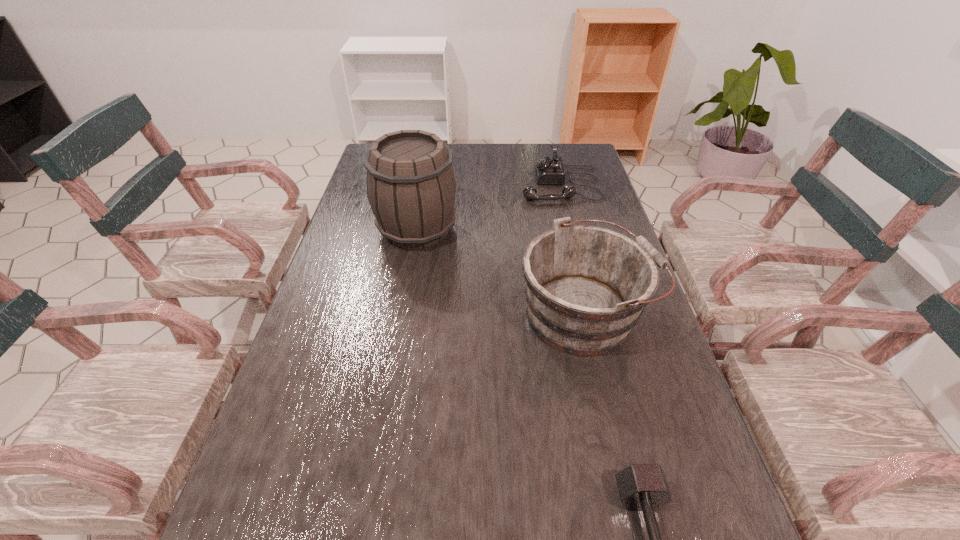
At what (x,y) coordinates should I click in order to perform the action: click on free space located on the dial of the farthest object. Please return your answer as a coordinate pair (x, y). The image size is (960, 540). Looking at the image, I should click on (441, 184).

You are a GUI agent. You are given a task and a screenshot of the screen. Output one action in this format:
    pyautogui.click(x=<x>, y=<y>)
    Task: Click on the object situated at the far edge
    The image size is (960, 540).
    Given the screenshot: What is the action you would take?
    pyautogui.click(x=548, y=170)

I want to click on object that is positioned at the left edge, so click(411, 187).

Where is `wine bucket located at the right edge`? wine bucket located at the right edge is located at coordinates (586, 287).

I want to click on telephone at the right edge, so click(548, 170).

Identify the location of object located at the far right corner. (548, 170).

Identify the location of vacant space at the far edge. This screenshot has width=960, height=540. point(474,176).

The height and width of the screenshot is (540, 960). I want to click on vacant space at the left edge of the desktop, so click(x=330, y=350).

Find the location of a particular element. This screenshot has width=960, height=540. free location at the right edge is located at coordinates click(587, 185).

Find the location of a particular element. free space between the leftmost object and the farthest object is located at coordinates (489, 207).